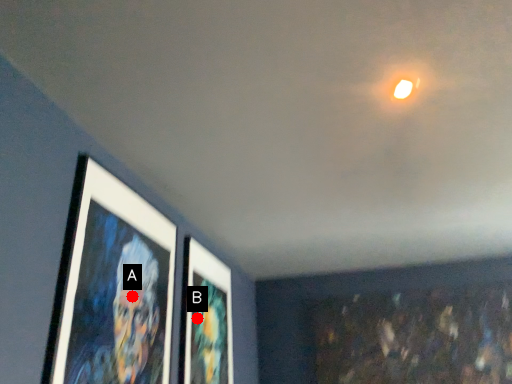
Question: Two points are circled on the image, labeled by A and B beside each circle. Among these points, which one is nearest to the camera?

Choices:
 (A) A is closer
 (B) B is closer

Answer: (A)